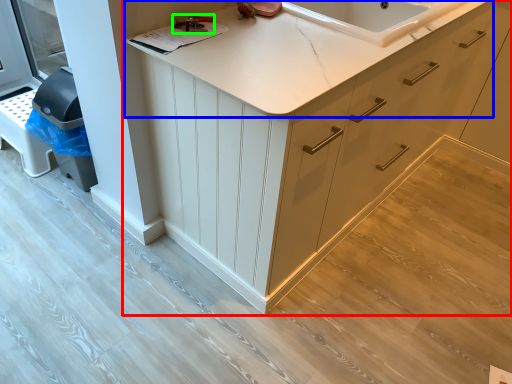
Question: Estimate the real-world distances between objects in this image. Which object is farther from cabinetry (highlighted by a red box), countertop (highlighted by a blue box) or tool (highlighted by a green box)?

Choices:
 (A) countertop
 (B) tool

Answer: (B)